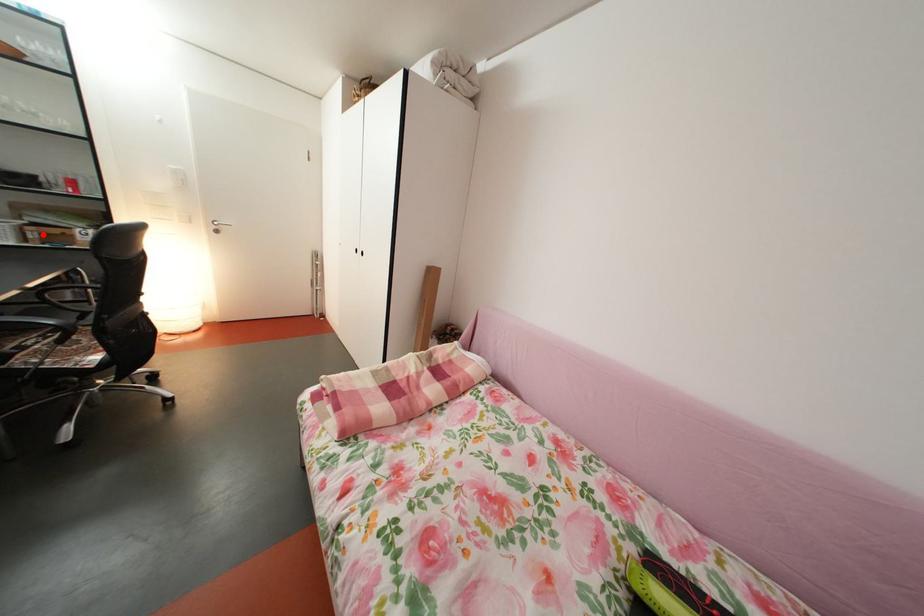
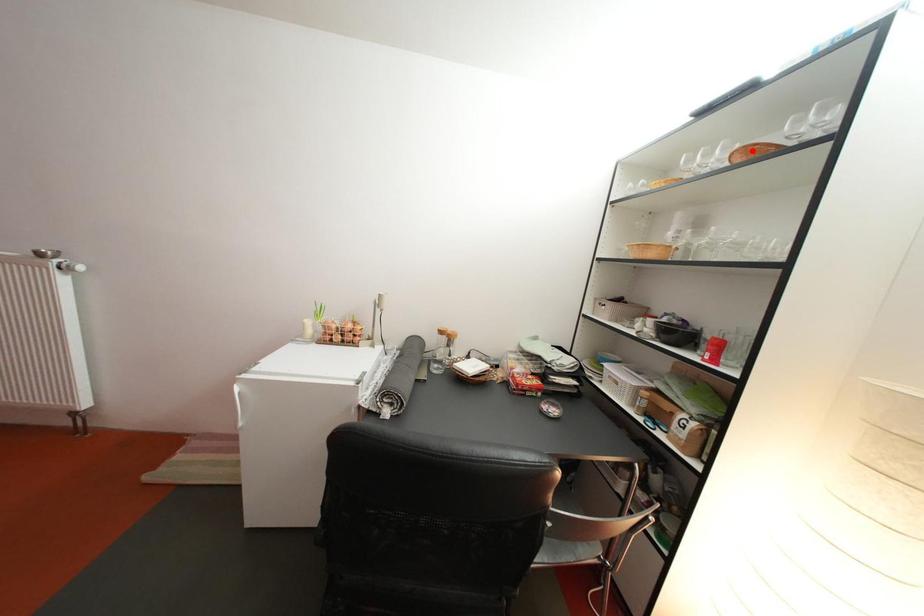
I am providing you with two images of the same scene from different viewpoints. A red point is marked on the first image and another point is marked on the second image. Do the highlighted points in image1 and image2 indicate the same real-world spot?

No